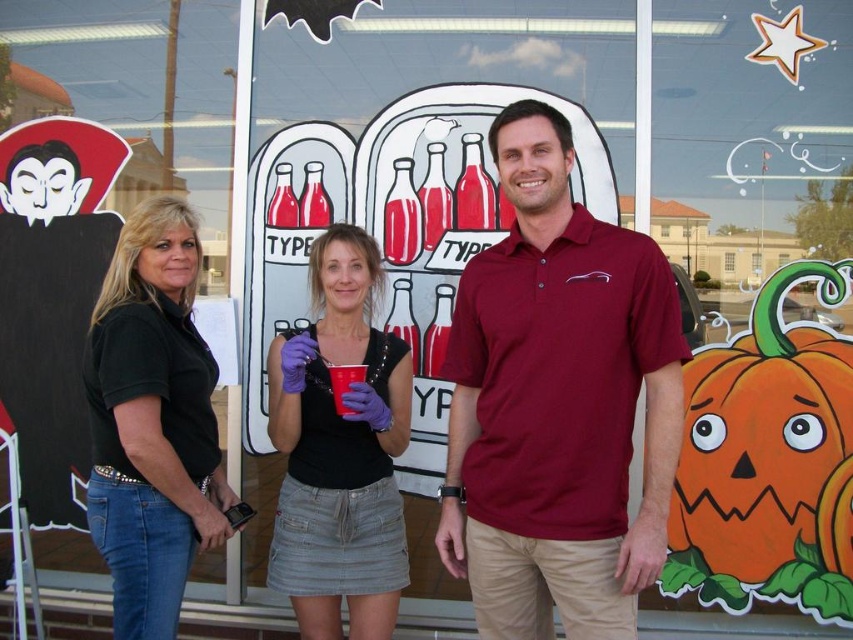
You are a customer looking at the storefront window and notice the maroon polo shirt at center and the black denim jeans at left. Which item is nearer to you?

The maroon polo shirt at center is closer to the viewer than the black denim jeans at left.

Based on the photo, you are a fashion designer observing the scene. You need to create a new outfit that combines elements from the maroon polo shirt at center and the black denim jeans at left. Based on their widths, which item should be the base for the outfit to ensure proper proportions?

The maroon polo shirt at center might be wider than black denim jeans at left, so using the maroon polo shirt at center as the base would provide a wider foundation, ensuring the outfit maintains balanced proportions when combined with the jeans.

You are standing in front of the Halloween storefront window. You see the black denim jeans at left. Where exactly are they located in the window?

The black denim jeans at left are located at the 2D coordinates point (152, 420) in the window.